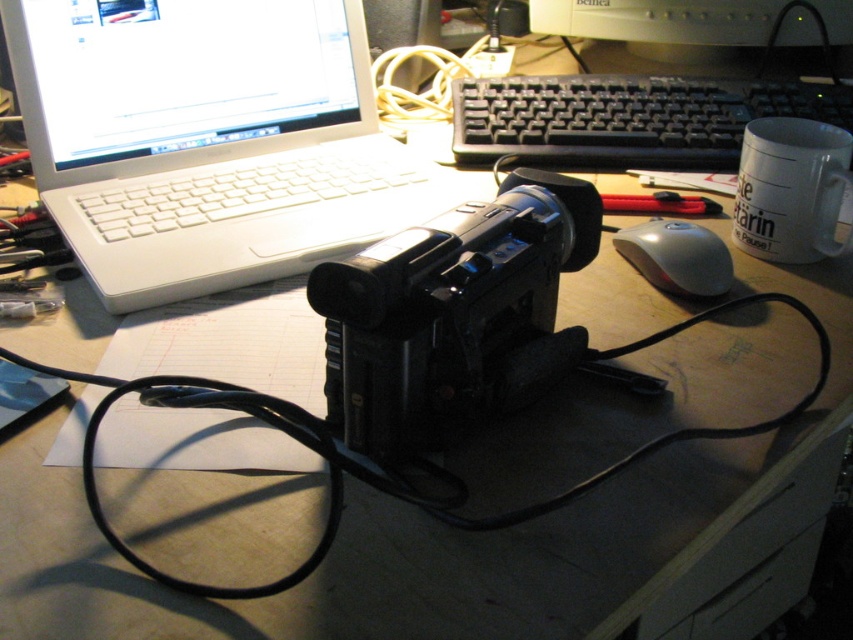
Question: Among these points, which one is nearest to the camera?

Choices:
 (A) (799, 186)
 (B) (805, 6)
 (C) (708, 288)

Answer: (C)

Question: Does black plastic camera at center have a greater width compared to silver metallic desktop computer at upper center?

Choices:
 (A) yes
 (B) no

Answer: (B)

Question: Among these points, which one is farthest from the camera?

Choices:
 (A) (538, 260)
 (B) (659, 284)
 (C) (158, 152)
 (D) (627, 97)

Answer: (D)

Question: Which point appears closest to the camera in this image?

Choices:
 (A) (572, 33)
 (B) (466, 317)
 (C) (766, 205)

Answer: (B)

Question: Does black plastic keyboard at upper center come behind white ceramic mug at upper right?

Choices:
 (A) yes
 (B) no

Answer: (A)

Question: From the image, what is the correct spatial relationship of black plastic camera at center in relation to satin silver mouse at center right?

Choices:
 (A) above
 (B) below

Answer: (B)